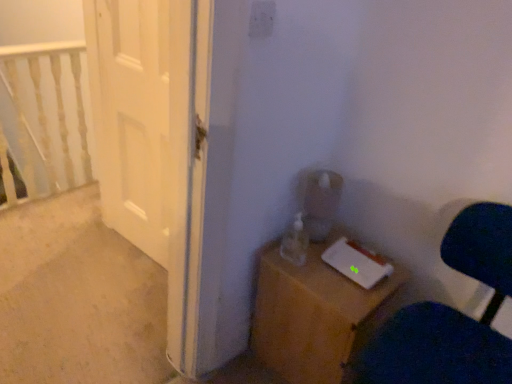
Question: In the image, is white glossy door at left positioned in front of or behind white painted wood railing at upper left?

Choices:
 (A) front
 (B) behind

Answer: (A)

Question: Is point pos(102,125) positioned closer to the camera than point pos(3,49)?

Choices:
 (A) closer
 (B) farther

Answer: (A)

Question: Estimate the real-world distances between objects in this image. Which object is closer to the wooden nightstand at lower right?

Choices:
 (A) white painted wood railing at upper left
 (B) velvet dark blue chair at lower right
 (C) white glossy door at left

Answer: (B)

Question: Based on their relative distances, which object is nearer to the white painted wood railing at upper left?

Choices:
 (A) white glossy door at left
 (B) velvet dark blue chair at lower right
 (C) wooden nightstand at lower right

Answer: (A)